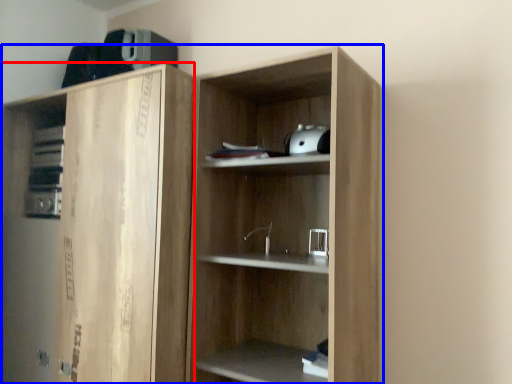
Question: Among these objects, which one is farthest to the camera, cabinetry (highlighted by a red box) or cupboard (highlighted by a blue box)?

Choices:
 (A) cabinetry
 (B) cupboard

Answer: (A)